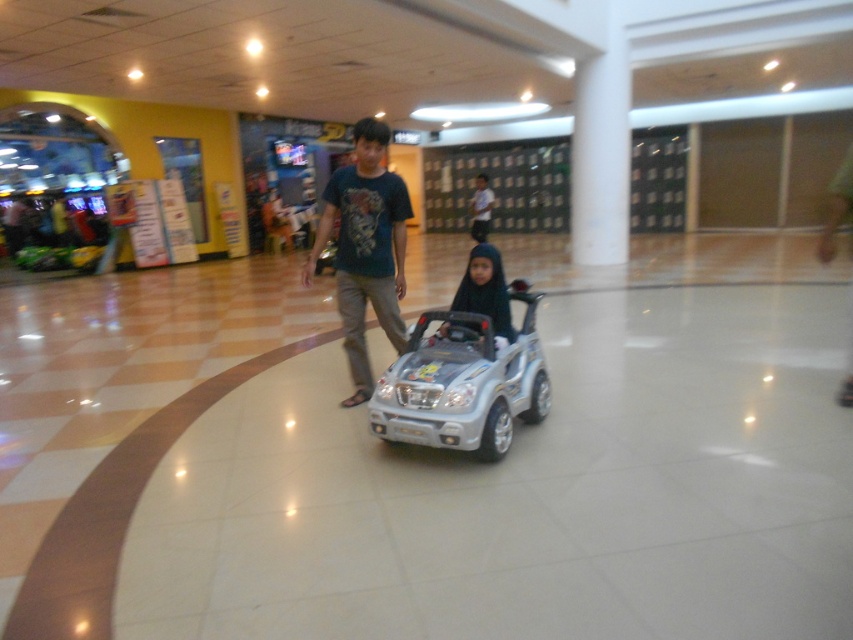
You are a photographer positioned at the center of the image. You want to capture a closeup shot of the dark blue fabric hijab at center. Based on its 2D coordinates, which direction should you move your camera to focus on it?

The dark blue fabric hijab at center is located at point 0.456 on the x axis and 0.571 on the y axis. Since the photographer is at the center of the image, which is point 0.5 on both axes, they should move the camera slightly to the left and down to focus on the hijab.